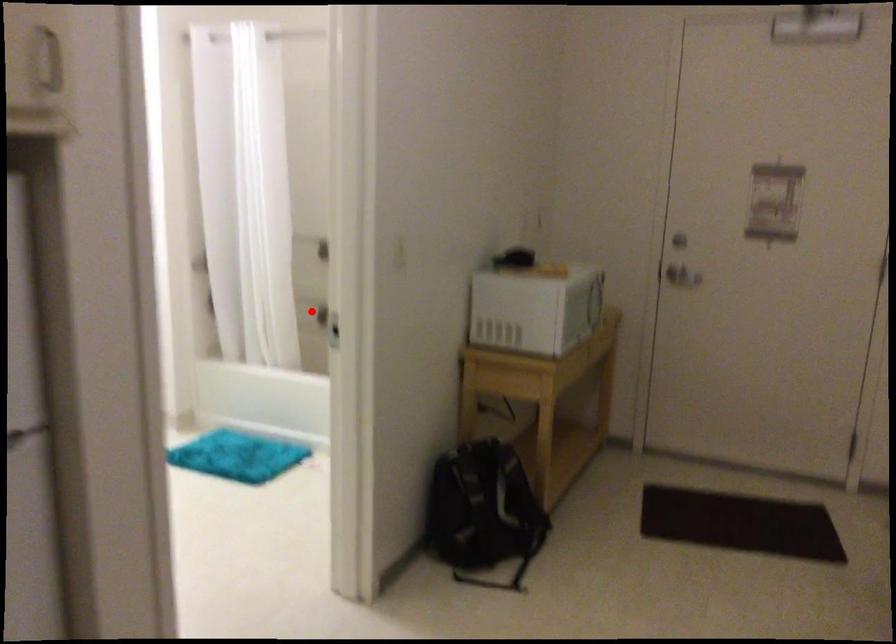
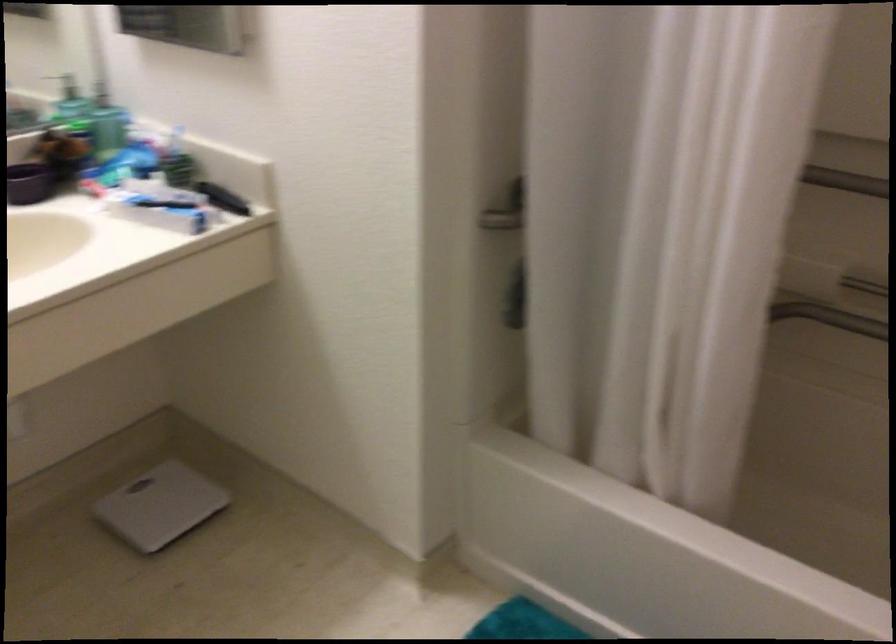
Question: I am providing you with two images of the same scene from different viewpoints. A red point is marked on the first image. At the location where the point appears in image 1, is it still visible in image 2?

Choices:
 (A) Yes
 (B) No

Answer: (B)